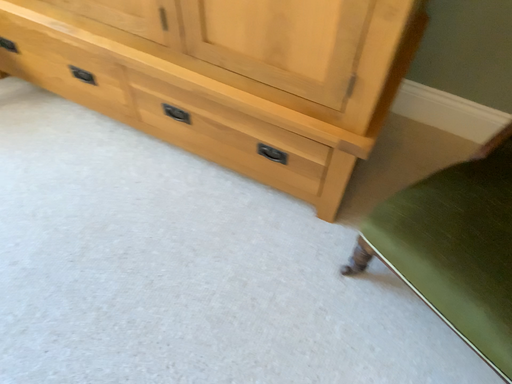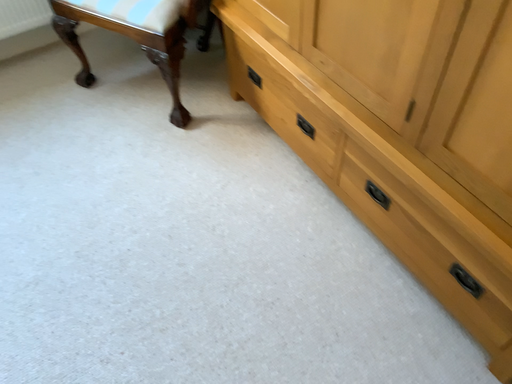
Question: How did the camera likely rotate when shooting the video?

Choices:
 (A) rotated upward
 (B) rotated downward

Answer: (A)